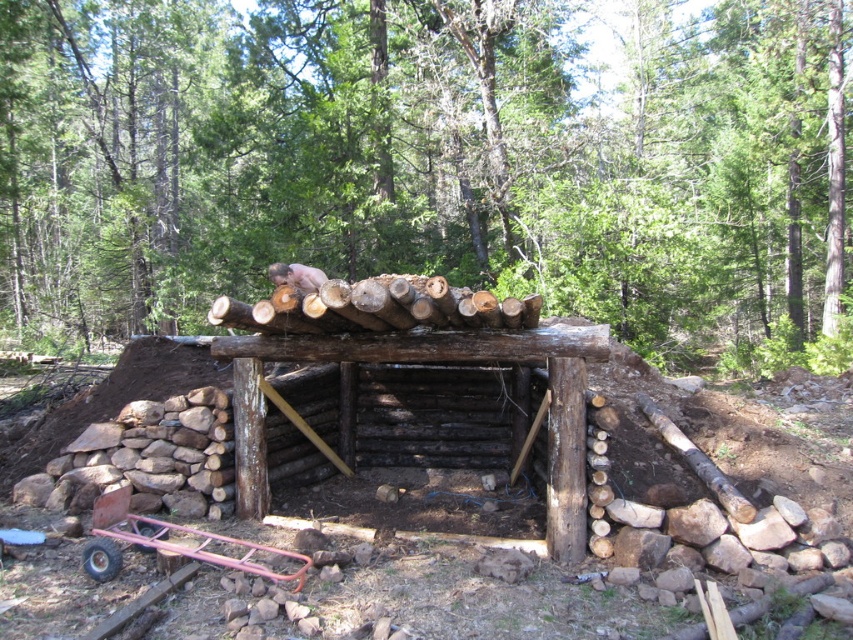
You are a construction worker who needs to place a tool on the brown rough wood at upper center and the natural wood log shelter at center. Which object should you place the tool on if you want it closer to the left side of the shelter?

The brown rough wood at upper center is positioned on the left side of the natural wood log shelter at center, so placing the tool there would place it closer to the left side of the shelter.

You are a construction worker who needs to transport the brown rough wood at upper center and the metallic pink cart at lower left using a truck with a 2 meter wide bed. Can both items fit side by side on the truck bed?

The brown rough wood at upper center is wider than the metallic pink cart at lower left. Since the truck bed is 2 meters wide, we need to know the exact widths of both items to determine if they can fit together. However, the description only states that the brown rough wood at upper center is wider than the metallic pink cart at lower left, but does not provide specific measurements. Therefore, it is uncertain if they can fit side by side without additional information.